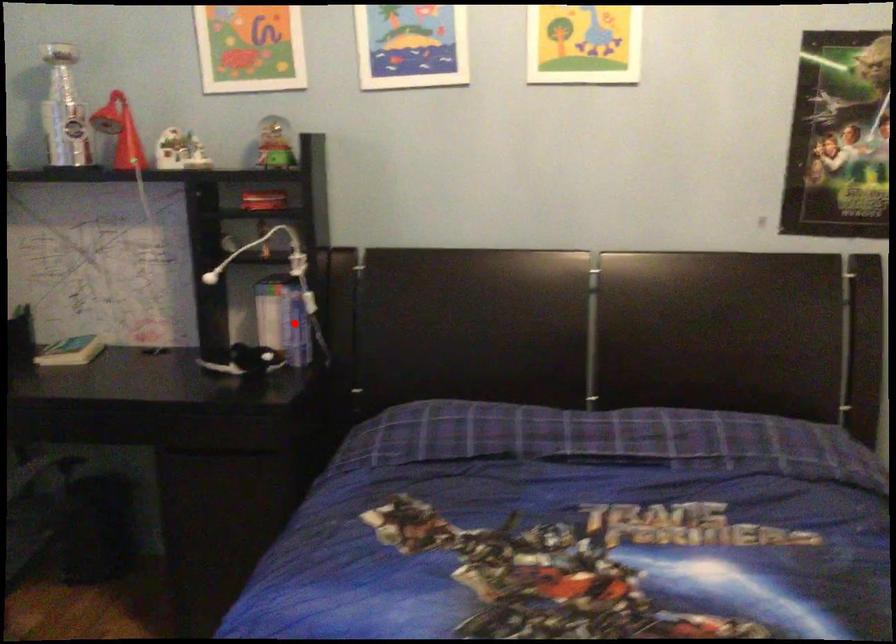
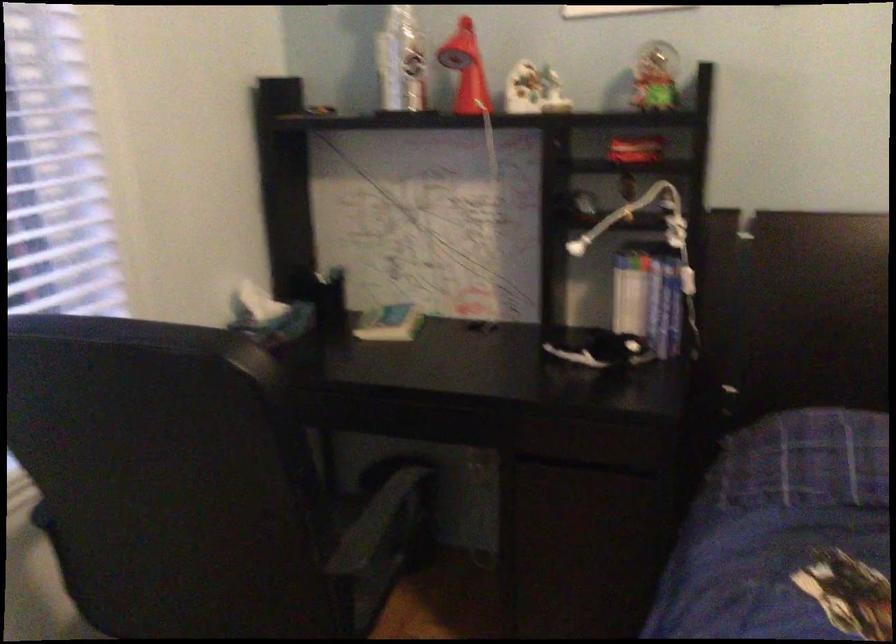
Question: A red point is marked in image1. In image2, is the corresponding 3D point closer to the camera or farther? Reply with the corresponding letter.

Choices:
 (A) The corresponding 3D point is closer.
 (B) The corresponding 3D point is farther.

Answer: (A)